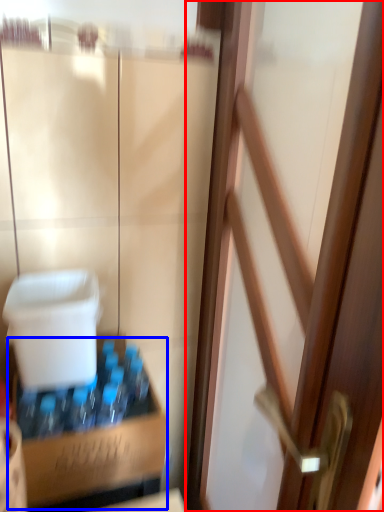
Question: Which of the following is the closest to the observer, door (highlighted by a red box) or cardboard box (highlighted by a blue box)?

Choices:
 (A) door
 (B) cardboard box

Answer: (A)